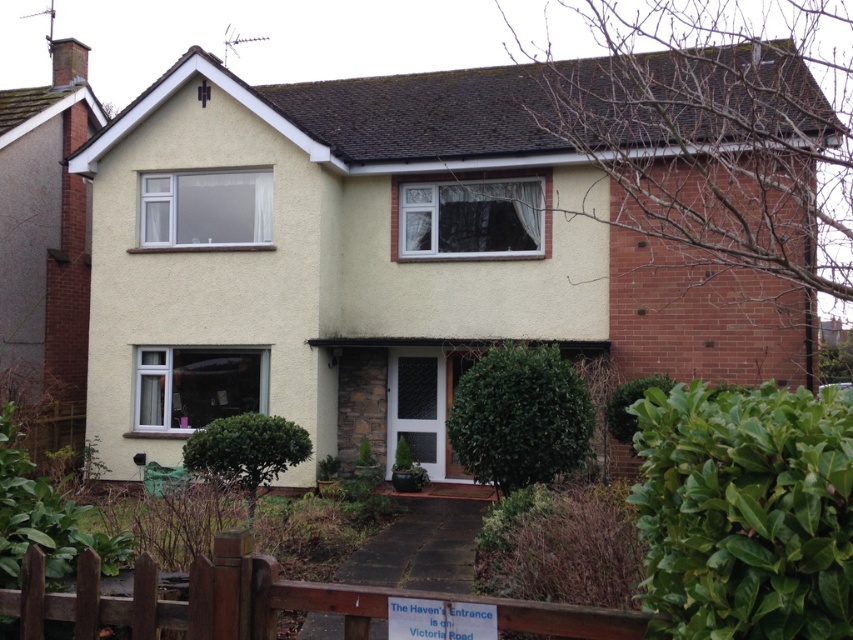
Question: Is green leafy hedge at lower right to the left of brown wooden gate at lower center from the viewer's perspective?

Choices:
 (A) no
 (B) yes

Answer: (A)

Question: Is brown wooden gate at lower center to the left of green leafy bush at center from the viewer's perspective?

Choices:
 (A) yes
 (B) no

Answer: (A)

Question: Which object is positioned farthest from the green leafy hedge at lower right?

Choices:
 (A) green leafy bush at center
 (B) green leafy hedge at lower center
 (C) brown wooden gate at lower center

Answer: (B)

Question: Can you confirm if brown wooden gate at lower center is smaller than green leafy bush at center?

Choices:
 (A) yes
 (B) no

Answer: (A)

Question: Which of the following is the closest to the observer?

Choices:
 (A) green leafy bush at center
 (B) green leafy hedge at lower center

Answer: (B)

Question: Which object is positioned farthest from the green leafy bush at center?

Choices:
 (A) green leafy hedge at lower center
 (B) green leafy hedge at lower right
 (C) brown wooden gate at lower center

Answer: (C)